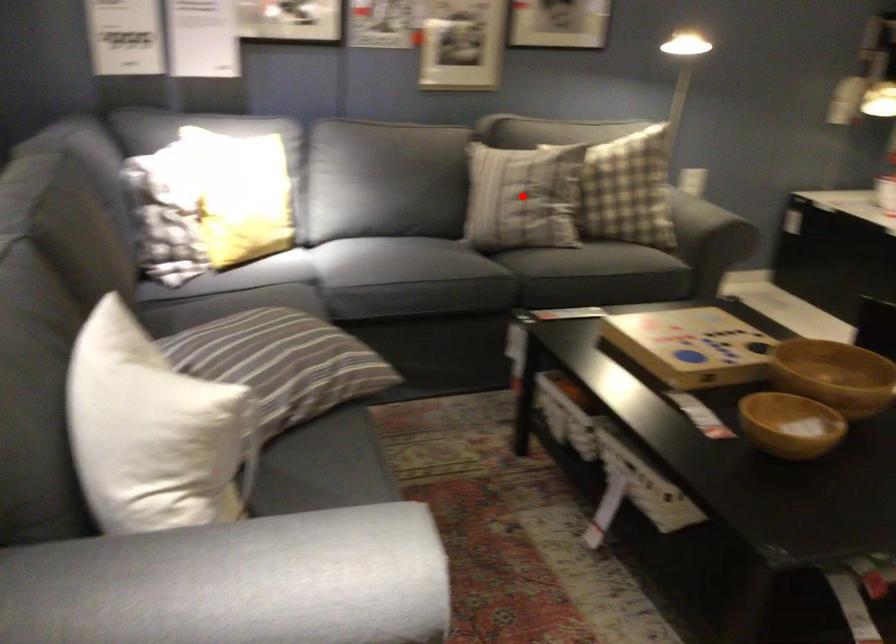
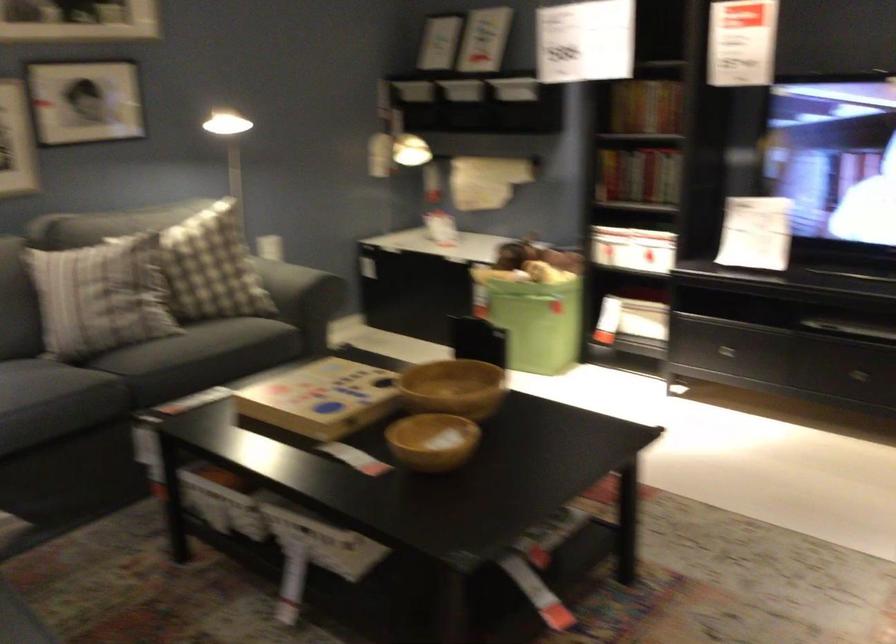
Find the pixel in the second image that matches the highlighted location in the first image.

(99, 296)